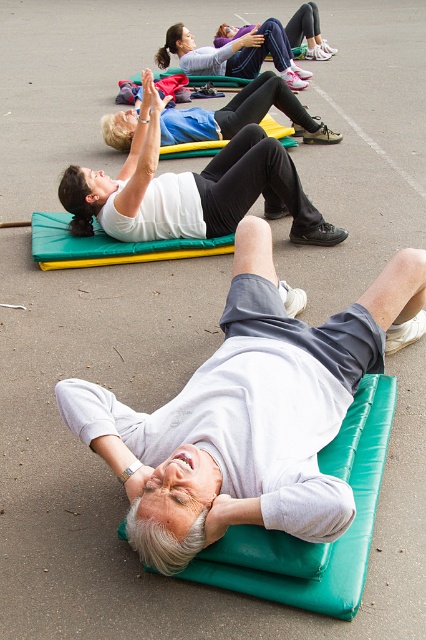
You are standing at the center of the paved area and want to place a small water bottle on the asphalt surface. There is a gray fabric mat at lower center. Where should you place the water bottle so it doesn not fall off the mat? Please provide coordinates in the format of point. The coordinates of the gray fabric mat at lower center is point (249,412).

The point (249,412) is on the gray fabric mat at lower center, so placing the water bottle at that coordinate will ensure it stays on the mat.

You are a fitness instructor observing the exercise session. You notice the gray fabric mat at lower center and the matte white shirt at upper center. Which object is closer to the front of the scene?

The gray fabric mat at lower center is closer to the front of the scene because it is in front of the matte white shirt at upper center.

Based on the photo, you are an athlete preparing to place a 10cm wide equipment on the ground between the matte white shirt at upper center and the matte purple leggings at upper center. Based on their widths, will the equipment fit without overlapping either?

The matte white shirt at upper center has a lesser width compared to matte purple leggings at upper center. Since the equipment is 10cm wide, it can fit between them as long as the total available space between the two objects is at least 10cm. However, the exact distance isn